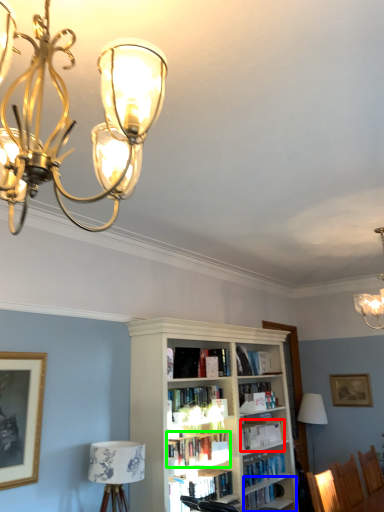
Question: Which object is the closest to the book (highlighted by a red box)? Choose among these: shelf (highlighted by a blue box) or book (highlighted by a green box).

Choices:
 (A) shelf
 (B) book

Answer: (A)